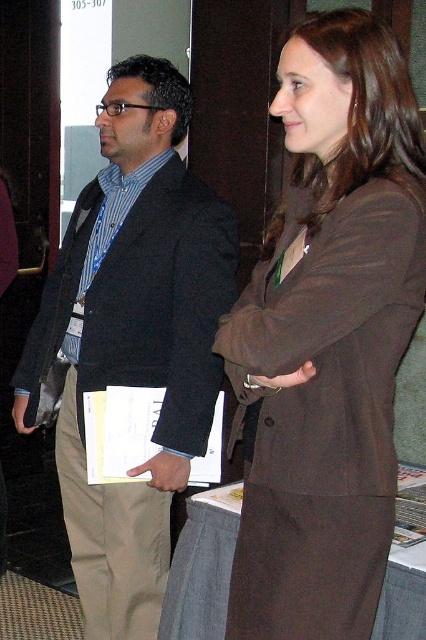
Question: Estimate the real-world distances between objects in this image. Which object is closer to the dark gray suit at left?

Choices:
 (A) brown matte suit at center
 (B) matte brown hand at center

Answer: (A)

Question: Is dark gray suit at left further to camera compared to matte brown hand at center?

Choices:
 (A) yes
 (B) no

Answer: (A)

Question: Which of the following is the closest to the observer?

Choices:
 (A) brown matte suit at center
 (B) matte brown hand at center

Answer: (A)

Question: Which object is the closest to the dark gray suit at left?

Choices:
 (A) matte brown hand at center
 (B) brown matte suit at center

Answer: (B)

Question: Is dark gray suit at left below matte brown hand at center?

Choices:
 (A) yes
 (B) no

Answer: (B)

Question: Can you confirm if dark gray suit at left is positioned to the right of matte brown hand at center?

Choices:
 (A) yes
 (B) no

Answer: (B)